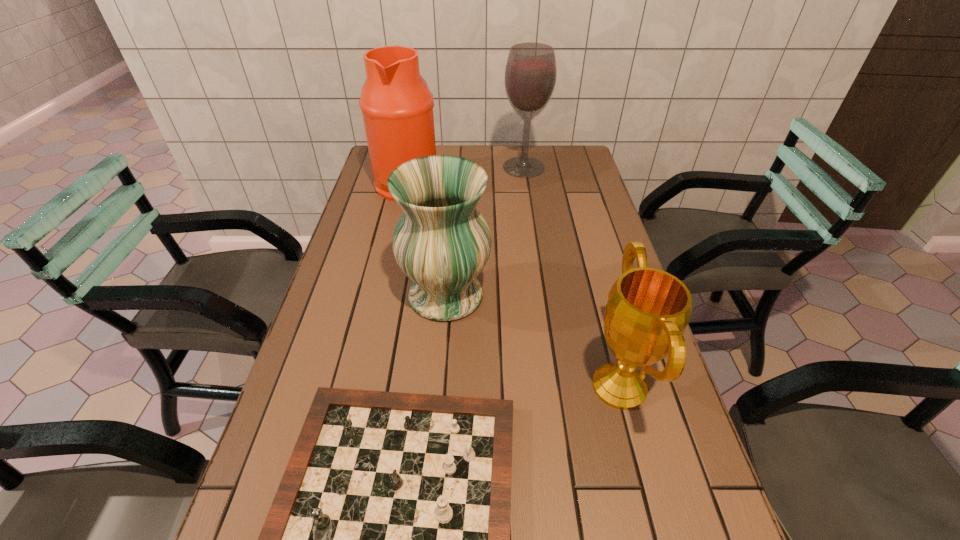
The image size is (960, 540). In the image, there is a desktop. Find the location of `blank space at the far right corner`. blank space at the far right corner is located at coordinates (577, 161).

Find the location of a particular element. This screenshot has height=540, width=960. free space between the award and the alcohol is located at coordinates (571, 276).

Locate which object ranks in proximity to the vase. Please provide its 2D coordinates. Your answer should be formatted as a tuple, i.e. [(x, y)], where the tuple contains the x and y coordinates of a point satisfying the conditions above.

[(388, 539)]

Identify which object is the fourth nearest to the water jug. Please provide its 2D coordinates. Your answer should be formatted as a tuple, i.e. [(x, y)], where the tuple contains the x and y coordinates of a point satisfying the conditions above.

[(388, 539)]

Find the location of a particular element. blank area in the image that satisfies the following two spatial constraints: 1. on the back side of the vase; 2. from the spout of the water jug is located at coordinates (455, 182).

The width and height of the screenshot is (960, 540). Find the location of `free space that satisfies the following two spatial constraints: 1. from the spout of the water jug; 2. on the right side of the third nearest object`. free space that satisfies the following two spatial constraints: 1. from the spout of the water jug; 2. on the right side of the third nearest object is located at coordinates (382, 295).

At what (x,y) coordinates should I click in order to perform the action: click on free space that satisfies the following two spatial constraints: 1. on the front side of the alcohol; 2. from the spout of the water jug. Please return your answer as a coordinate pair (x, y). The image size is (960, 540). Looking at the image, I should click on (526, 182).

This screenshot has height=540, width=960. I want to click on free space that satisfies the following two spatial constraints: 1. from the spout of the water jug; 2. on the back side of the third nearest object, so click(382, 295).

The width and height of the screenshot is (960, 540). Identify the location of free space that satisfies the following two spatial constraints: 1. from the spout of the water jug; 2. on the left side of the vase. (382, 295).